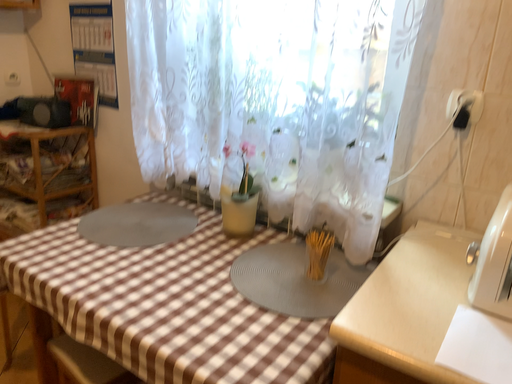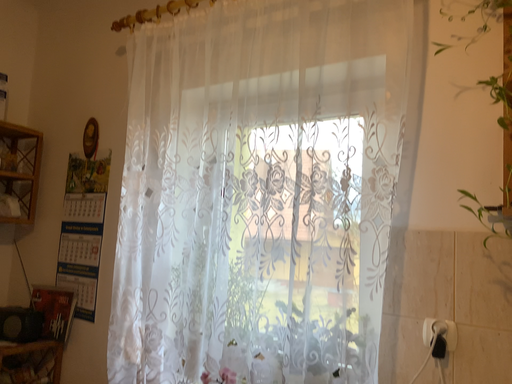
Question: Which way did the camera rotate in the video?

Choices:
 (A) rotated downward
 (B) rotated upward

Answer: (B)